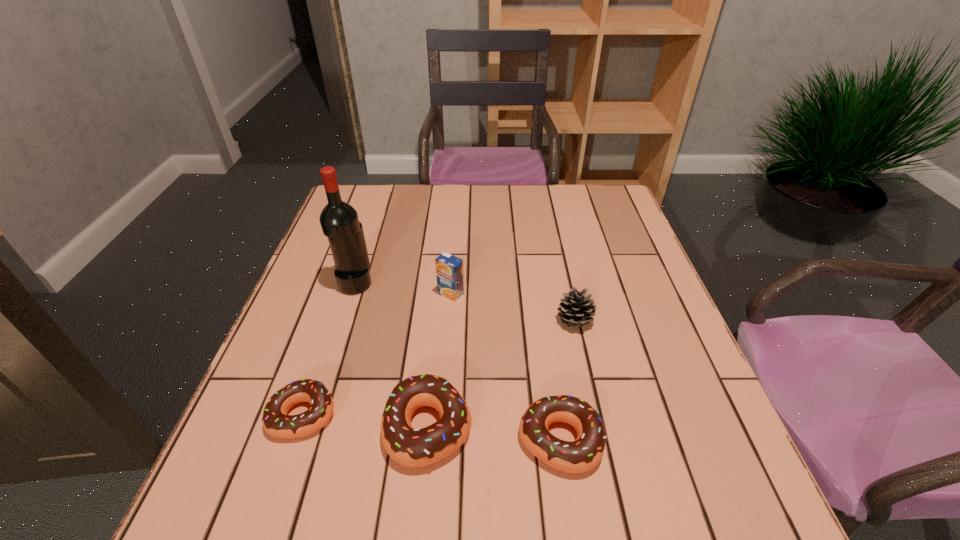
This screenshot has height=540, width=960. What are the coordinates of `free spot between the second shortest object and the second doughnut from right to left` in the screenshot? It's located at (493, 434).

Identify the location of blank region between the leftmost doughnut and the second doughnut from left to right. (366, 421).

Where is `vacant space that's between the second shortest object and the tallest object`? vacant space that's between the second shortest object and the tallest object is located at coordinates (458, 361).

Identify the location of the closest object relative to the wine bottle. The width and height of the screenshot is (960, 540). (449, 269).

Identify the location of the third closest object to the rightmost doughnut. (449, 269).

Where is `doughnut that stands as the second closest to the pinecone`? The image size is (960, 540). doughnut that stands as the second closest to the pinecone is located at coordinates (410, 447).

You are a GUI agent. You are given a task and a screenshot of the screen. Output one action in this format:
    pyautogui.click(x=<x>, y=<y>)
    Task: Click on the doughnut that stands as the second closest to the second doughnut from right to left
    This screenshot has height=540, width=960.
    Given the screenshot: What is the action you would take?
    pyautogui.click(x=275, y=421)

Locate an element on the screen. The height and width of the screenshot is (540, 960). vacant space that satisfies the following two spatial constraints: 1. on the back side of the shortest doughnut; 2. on the right side of the pinecone is located at coordinates (335, 321).

Where is `vacant space that satisfies the following two spatial constraints: 1. on the front side of the rightmost doughnut; 2. on the right side of the shortest object`? This screenshot has height=540, width=960. vacant space that satisfies the following two spatial constraints: 1. on the front side of the rightmost doughnut; 2. on the right side of the shortest object is located at coordinates (294, 441).

The width and height of the screenshot is (960, 540). In order to click on vacant area that satisfies the following two spatial constraints: 1. on the front side of the tallest object; 2. on the left side of the orange_juice in this screenshot , I will do pos(352,294).